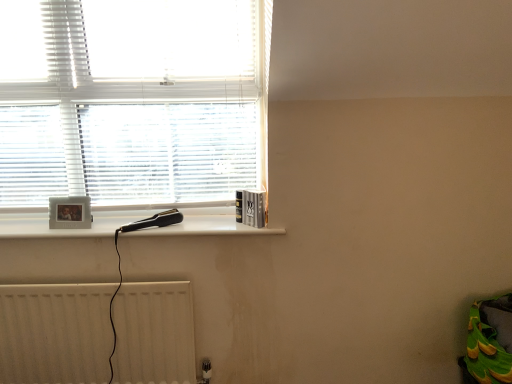
Question: From the image's perspective, is white textured radiator at lower left positioned above or below white textured blinds at upper left?

Choices:
 (A) below
 (B) above

Answer: (A)

Question: Does point (97, 372) appear closer or farther from the camera than point (52, 110)?

Choices:
 (A) closer
 (B) farther

Answer: (B)

Question: Which of these objects is positioned closest to the white textured radiator at lower left?

Choices:
 (A) white textured blinds at upper left
 (B) white plastic hairdryer at upper left

Answer: (B)

Question: Considering the real-world distances, which object is farthest from the white textured blinds at upper left?

Choices:
 (A) white plastic hairdryer at upper left
 (B) white textured radiator at lower left

Answer: (B)